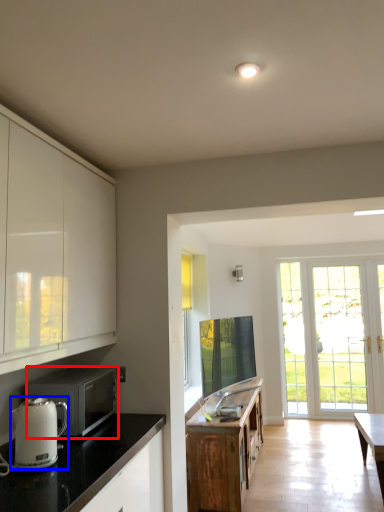
Question: Which of the following is the closest to the observer, microwave oven (highlighted by a red box) or kitchen appliance (highlighted by a blue box)?

Choices:
 (A) microwave oven
 (B) kitchen appliance

Answer: (B)